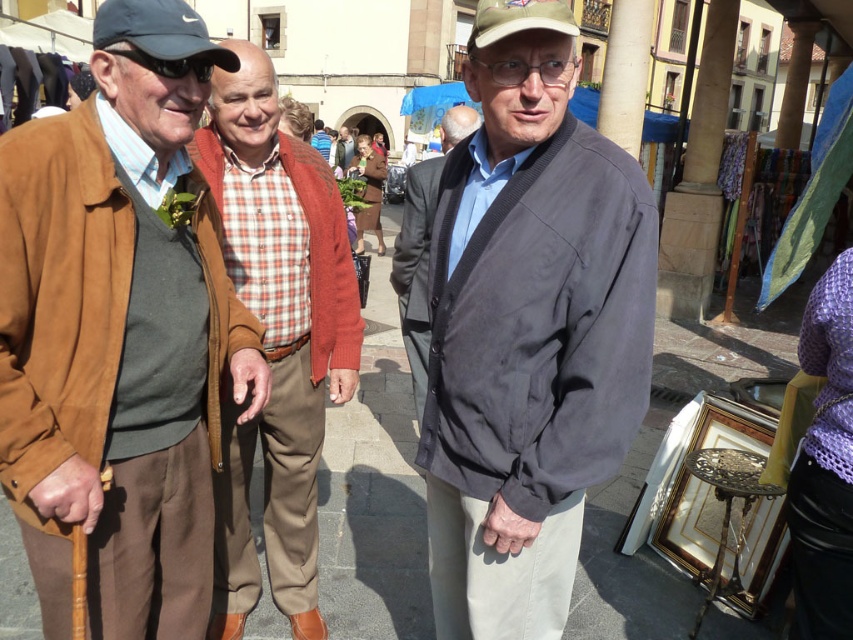
You are standing at the center of the square and want to approach the person wearing the brown suede jacket at left. Which direction should you move to reach them?

The brown suede jacket at left is located at point [120,332], so you should move to your left to reach them.